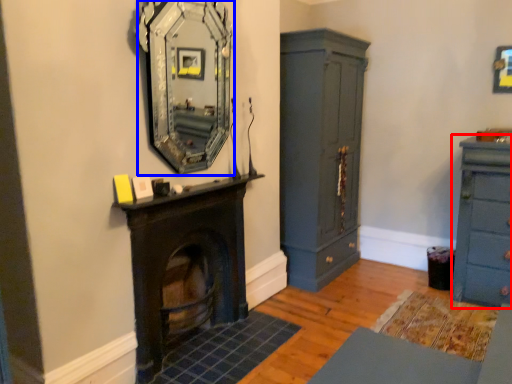
Question: Among these objects, which one is nearest to the camera, chest of drawers (highlighted by a red box) or mirror (highlighted by a blue box)?

Choices:
 (A) chest of drawers
 (B) mirror

Answer: (B)